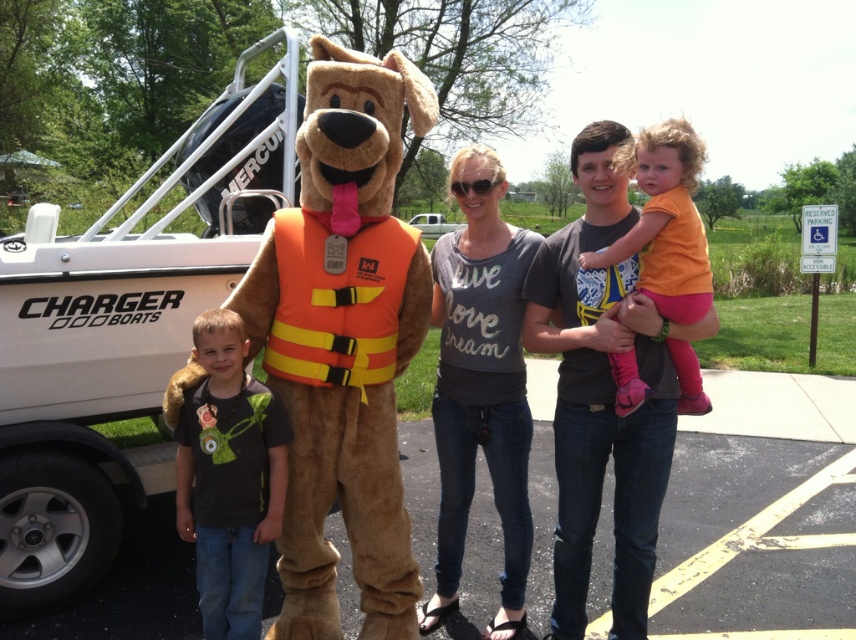
You are standing at the point marked by the coordinates point (599, 394). Looking around, you see the mascot in a dog costume with a life vest and the young boy in a dark t shirt with a colorful design and blue jeans. Which object is closer to your current position?

The dark gray t shirt at center is closer to your current position marked by point (599, 394) since the point marks its location.